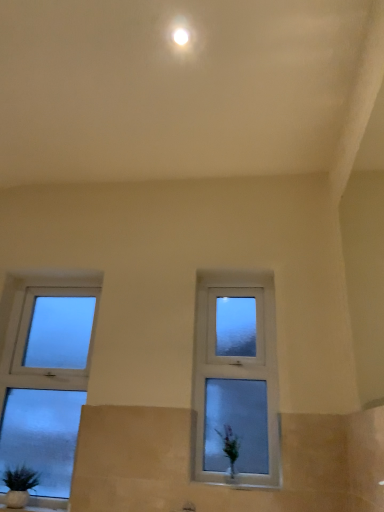
Question: From a real-world perspective, is white glossy vase at lower center physically above white glossy light at upper center?

Choices:
 (A) yes
 (B) no

Answer: (B)

Question: Is white glossy vase at lower center aimed at white glossy light at upper center?

Choices:
 (A) no
 (B) yes

Answer: (A)

Question: Considering the relative positions of white glossy vase at lower center and white glossy light at upper center in the image provided, is white glossy vase at lower center to the left of white glossy light at upper center from the viewer's perspective?

Choices:
 (A) yes
 (B) no

Answer: (B)

Question: Is white glossy vase at lower center thinner than white glossy light at upper center?

Choices:
 (A) yes
 (B) no

Answer: (B)

Question: Is the depth of white glossy vase at lower center less than that of white glossy light at upper center?

Choices:
 (A) yes
 (B) no

Answer: (B)

Question: Does white glossy vase at lower center have a greater width compared to white glossy light at upper center?

Choices:
 (A) yes
 (B) no

Answer: (A)

Question: Considering the relative sizes of clear glass window at center, which appears as the first window when viewed from the right, and white glossy light at upper center in the image provided, is clear glass window at center, which appears as the first window when viewed from the right, bigger than white glossy light at upper center?

Choices:
 (A) no
 (B) yes

Answer: (B)

Question: Is white glossy light at upper center a part of clear glass window at center, which appears as the first window when viewed from the right?

Choices:
 (A) yes
 (B) no

Answer: (B)

Question: Considering the relative sizes of clear glass window at center, which appears as the first window when viewed from the right, and white glossy light at upper center in the image provided, is clear glass window at center, which appears as the first window when viewed from the right, taller than white glossy light at upper center?

Choices:
 (A) yes
 (B) no

Answer: (A)

Question: Does clear glass window at center, which appears as the first window when viewed from the right, appear on the right side of white glossy light at upper center?

Choices:
 (A) yes
 (B) no

Answer: (A)

Question: Is clear glass window at center, which appears as the first window when viewed from the right, shorter than white glossy light at upper center?

Choices:
 (A) no
 (B) yes

Answer: (A)

Question: From a real-world perspective, is clear glass window at center, arranged as the second window when viewed from the left, on white glossy light at upper center?

Choices:
 (A) no
 (B) yes

Answer: (A)

Question: Considering the relative positions of green matte plant at lower left and frosted glass window at left, which ranks as the first window in left-to-right order, in the image provided, is green matte plant at lower left to the left of frosted glass window at left, which ranks as the first window in left-to-right order, from the viewer's perspective?

Choices:
 (A) no
 (B) yes

Answer: (B)